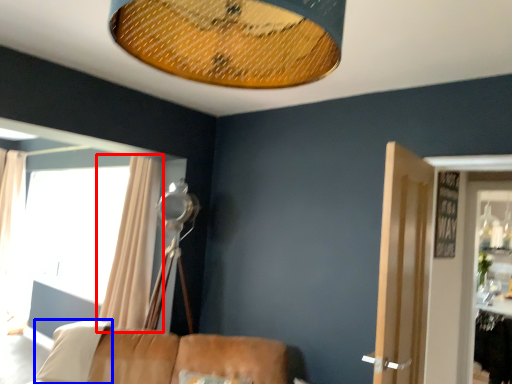
Question: Which object is further to the camera taking this photo, curtain (highlighted by a red box) or pillow (highlighted by a blue box)?

Choices:
 (A) curtain
 (B) pillow

Answer: (A)